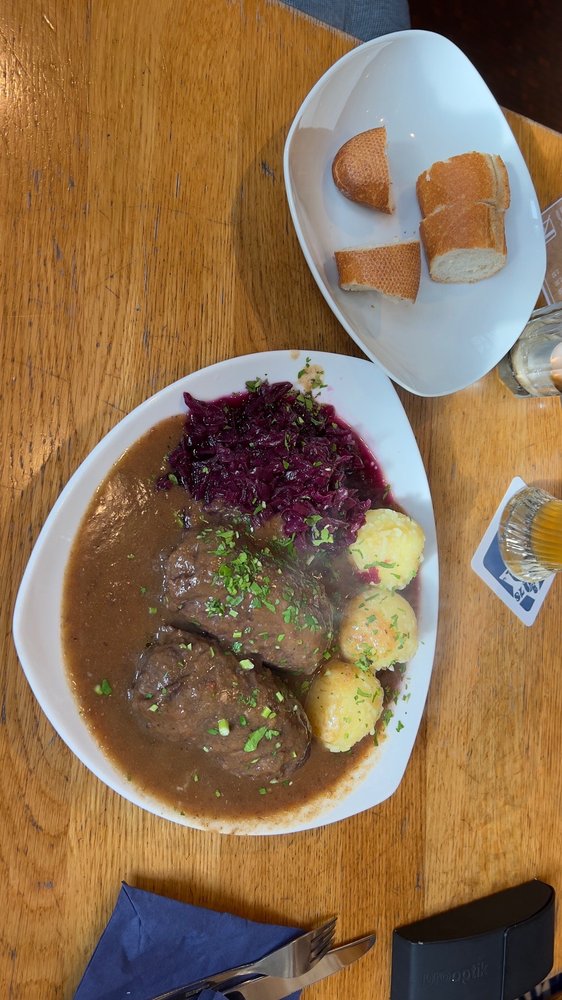
Where is `stainless steel fork facing down`? stainless steel fork facing down is located at coordinates (297, 960).